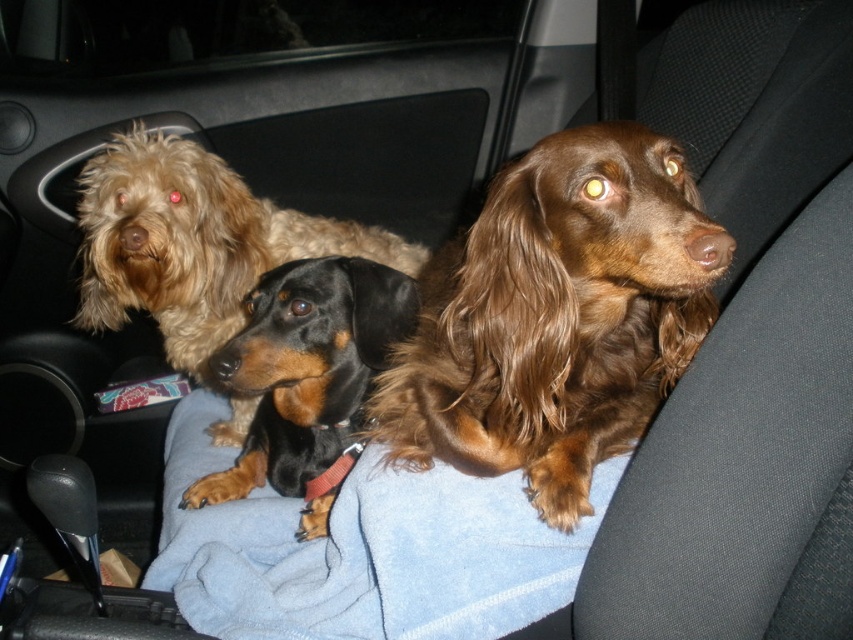
In the scene shown: You are sitting in the back seat of the car and want to reach two points inside the car. One is at point (663, 170) and the other is at point (206, 296). Which point is closer to you?

Point (663, 170) is closer to the viewer than point (206, 296).

You are a passenger in the car and want to pet the brown silky dog at center. Which direction should you move your hand to reach it?

The brown silky dog at center is located at point (556, 317), so you should move your hand towards the center of the car to reach it.